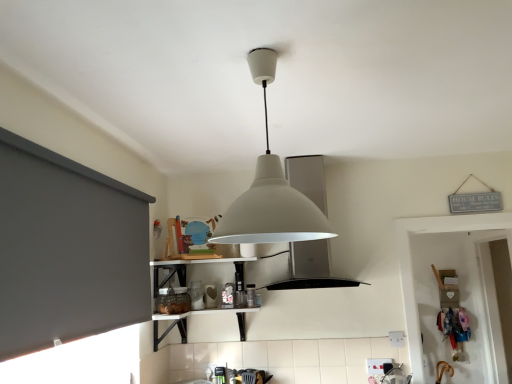
Question: From the image's perspective, does white matte lampshade at center appear lower than dark gray matte window screen at left?

Choices:
 (A) no
 (B) yes

Answer: (A)

Question: Is white matte lampshade at center positioned beyond the bounds of dark gray matte window screen at left?

Choices:
 (A) no
 (B) yes

Answer: (B)

Question: Is white matte lampshade at center shorter than dark gray matte window screen at left?

Choices:
 (A) no
 (B) yes

Answer: (B)

Question: Is white matte lampshade at center touching dark gray matte window screen at left?

Choices:
 (A) no
 (B) yes

Answer: (A)

Question: From a real-world perspective, is white matte lampshade at center on top of dark gray matte window screen at left?

Choices:
 (A) yes
 (B) no

Answer: (A)

Question: Is point (93, 309) positioned closer to the camera than point (273, 180)?

Choices:
 (A) farther
 (B) closer

Answer: (A)

Question: Which is correct: dark gray matte window screen at left is inside white matte lampshade at center, or outside of it?

Choices:
 (A) outside
 (B) inside

Answer: (A)

Question: From the image's perspective, is dark gray matte window screen at left above or below white matte lampshade at center?

Choices:
 (A) above
 (B) below

Answer: (B)

Question: Looking at their shapes, would you say dark gray matte window screen at left is wider or thinner than white matte lampshade at center?

Choices:
 (A) wide
 (B) thin

Answer: (B)

Question: In terms of height, does white matte vent at center look taller or shorter compared to white matte lampshade at center?

Choices:
 (A) tall
 (B) short

Answer: (A)

Question: Does point (290, 254) appear closer or farther from the camera than point (294, 198)?

Choices:
 (A) farther
 (B) closer

Answer: (A)

Question: Would you say white matte vent at center is inside or outside white matte lampshade at center?

Choices:
 (A) inside
 (B) outside

Answer: (B)

Question: From the image's perspective, is white matte vent at center located above or below white matte lampshade at center?

Choices:
 (A) above
 (B) below

Answer: (B)

Question: Does point (10, 246) appear closer or farther from the camera than point (309, 241)?

Choices:
 (A) farther
 (B) closer

Answer: (A)

Question: Is dark gray matte window screen at left taller or shorter than white matte vent at center?

Choices:
 (A) tall
 (B) short

Answer: (B)